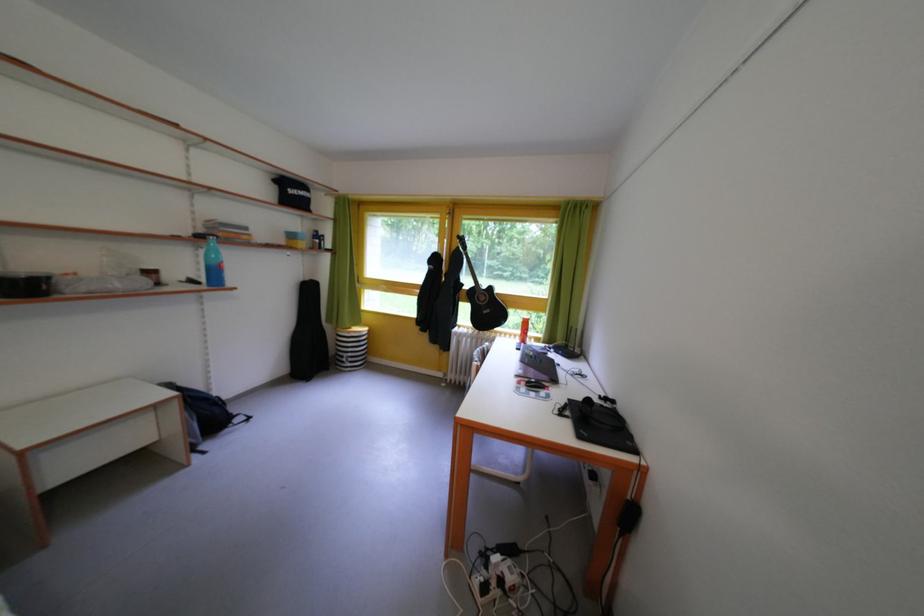
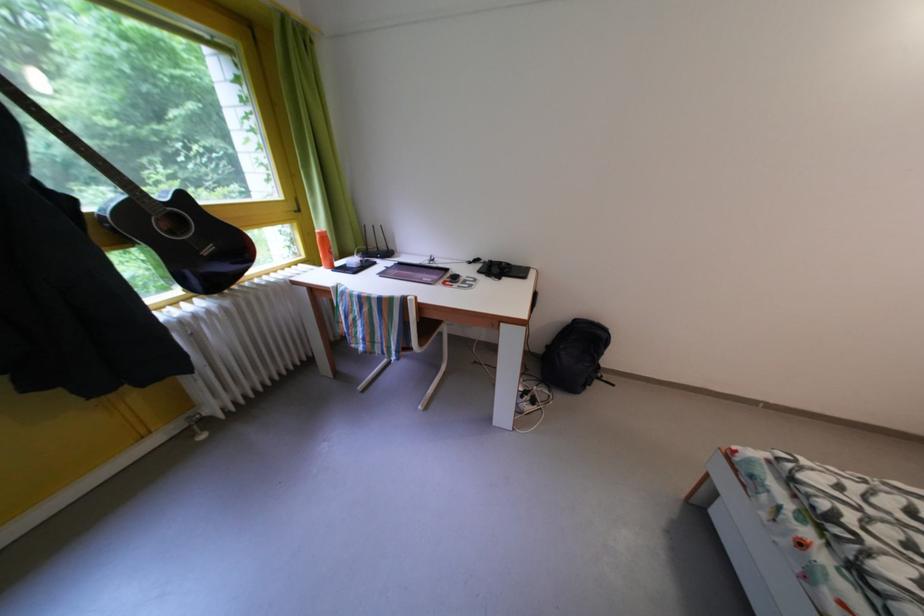
Where in the second image is the point corresponding to point (500, 294) from the first image?

(191, 203)